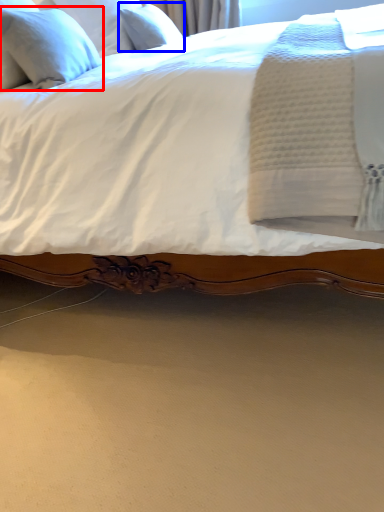
Question: Which point is closer to the camera, pillow (highlighted by a red box) or pillow (highlighted by a blue box)?

Choices:
 (A) pillow
 (B) pillow

Answer: (A)